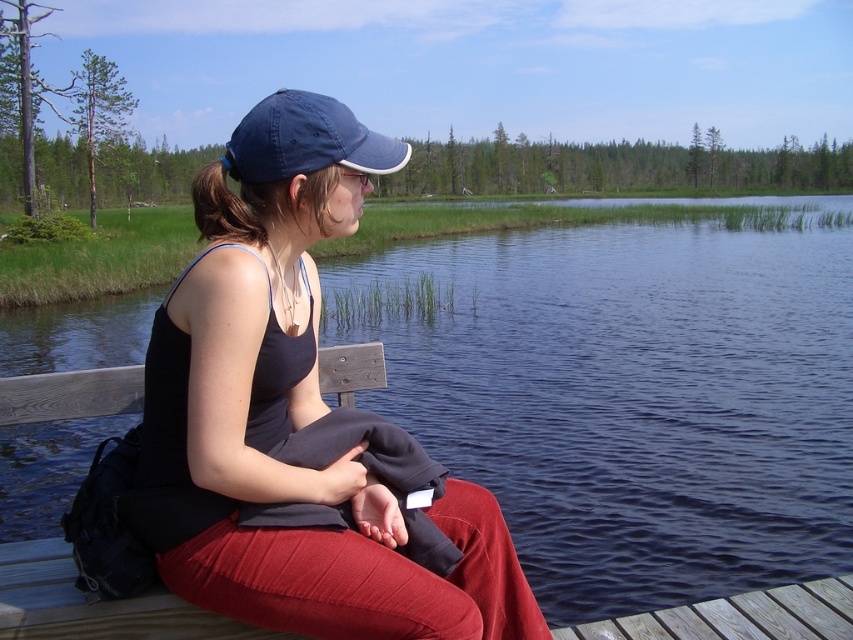
Question: From the image, what is the correct spatial relationship of blue water at center in relation to matte black tank top at center?

Choices:
 (A) right
 (B) left

Answer: (A)

Question: Is blue water at center thinner than matte black tank top at center?

Choices:
 (A) no
 (B) yes

Answer: (A)

Question: Is matte black tank top at center to the left of navy blue fabric cap at upper center from the viewer's perspective?

Choices:
 (A) yes
 (B) no

Answer: (B)

Question: Considering the real-world distances, which object is closest to the matte black tank top at center?

Choices:
 (A) navy blue fabric cap at upper center
 (B) blue water at center

Answer: (A)

Question: Among these objects, which one is farthest from the camera?

Choices:
 (A) blue water at center
 (B) navy blue fabric cap at upper center

Answer: (A)

Question: Estimate the real-world distances between objects in this image. Which object is closer to the navy blue fabric cap at upper center?

Choices:
 (A) blue water at center
 (B) matte black tank top at center

Answer: (B)